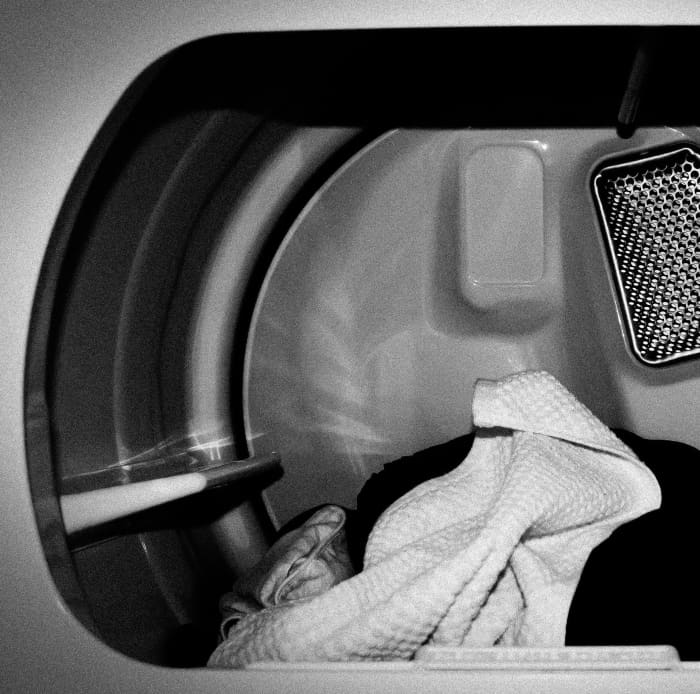
I want to click on light reflecting in dryer, so click(216, 441), click(356, 441), click(539, 144).